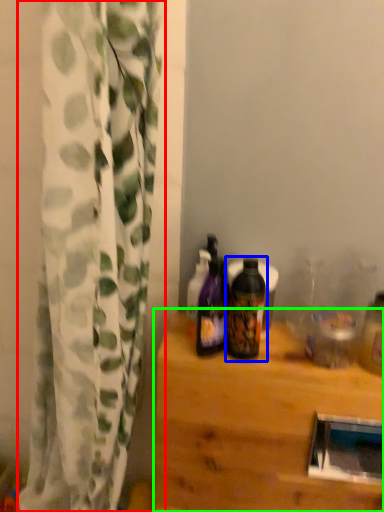
Question: Based on their relative distances, which object is farther from curtain (highlighted by a red box)? Choose from bottle (highlighted by a blue box) and table (highlighted by a green box).

Choices:
 (A) bottle
 (B) table

Answer: (A)